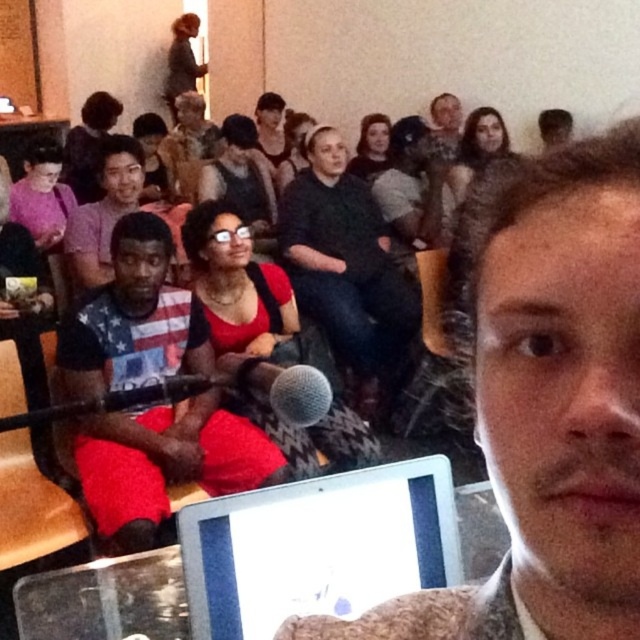
You are a photographer trying to capture a closeup of the speaker while ensuring the dark gray sweater at center and the matte black shirt at center are visible in the background. Which of the two clothing items will appear larger in the photo?

The dark gray sweater at center will appear larger in the photo because it has a greater height compared to the matte black shirt at center.

You are a photographer at the event and want to capture a photo that includes both the dark gray sweater at center and the matte black shirt at center. What is the minimum distance you need to maintain between the camera and these two subjects to ensure both are in the frame?

The dark gray sweater at center and matte black shirt at center are 32.67 inches apart from each other. To include both in the frame, the photographer must ensure the camera is positioned at least 32.67 inches away from the closer subject.

You are a photographer at the event and want to capture a closeup of the speaker. The speaker is holding a microphone at point (544, 401). Is the speaker facing towards the audience or away from them?

The speaker is facing towards the audience because the microphone is positioned close to their mouth, which is a common position when addressing an audience.